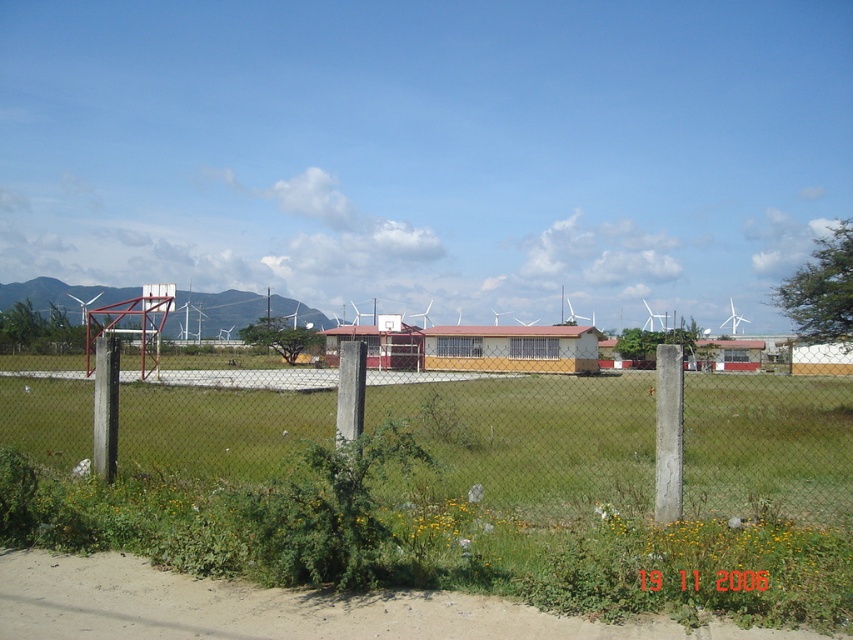
Between point (454, 378) and point (125, 333), which one is positioned in front?

Positioned in front is point (125, 333).

Between point (722, 476) and point (138, 298), which one is positioned behind?

Positioned behind is point (138, 298).

Who is more forward, (602,445) or (149,353)?

Point (602,445)

Find the location of a particular element. metal mesh fence at center is located at coordinates (531, 435).